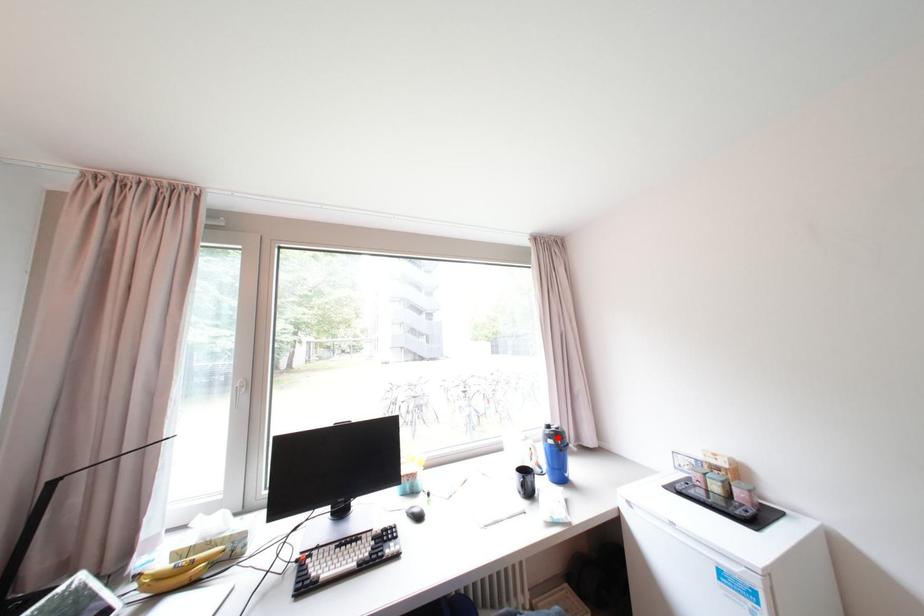
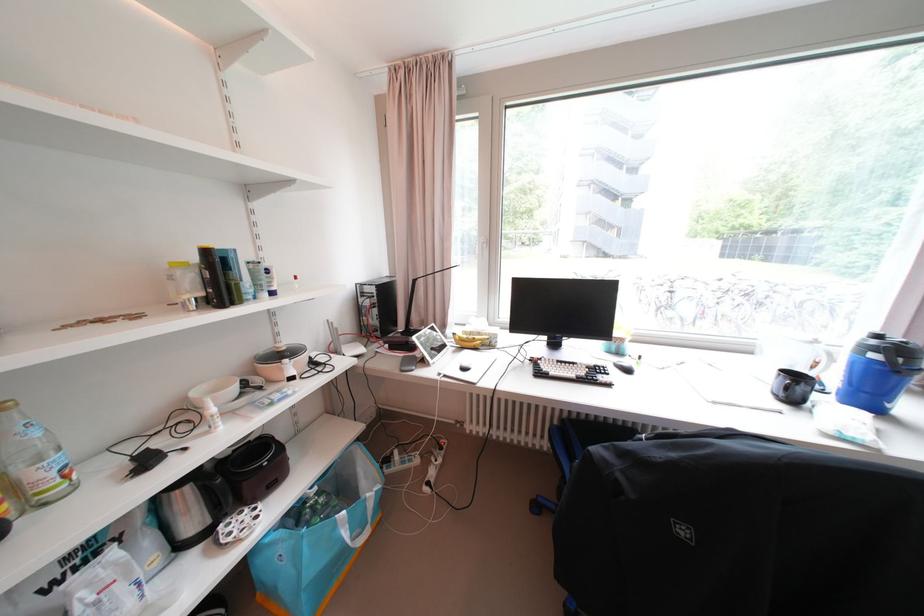
Locate, in the second image, the point that corresponds to the highlighted location in the first image.

(883, 350)